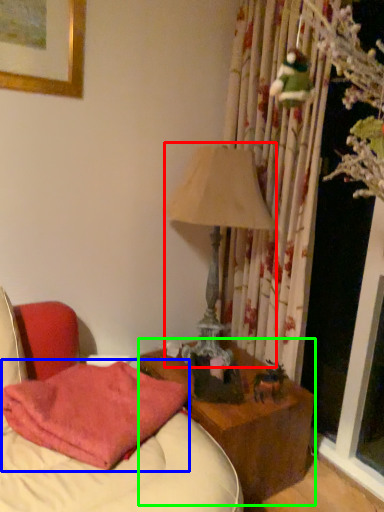
Question: Estimate the real-world distances between objects in this image. Which object is farther from table lamp (highlighted by a red box), pillow (highlighted by a blue box) or nightstand (highlighted by a green box)?

Choices:
 (A) pillow
 (B) nightstand

Answer: (B)